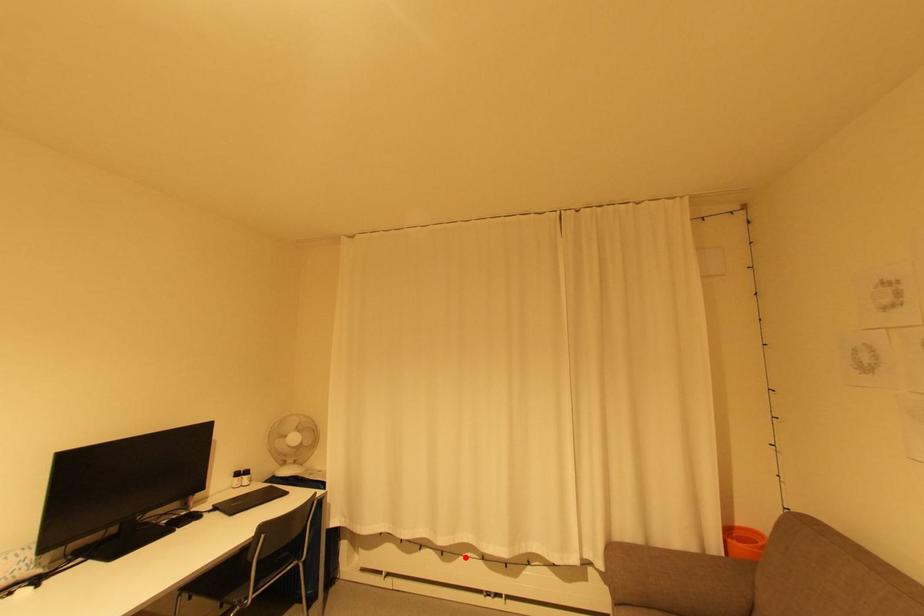
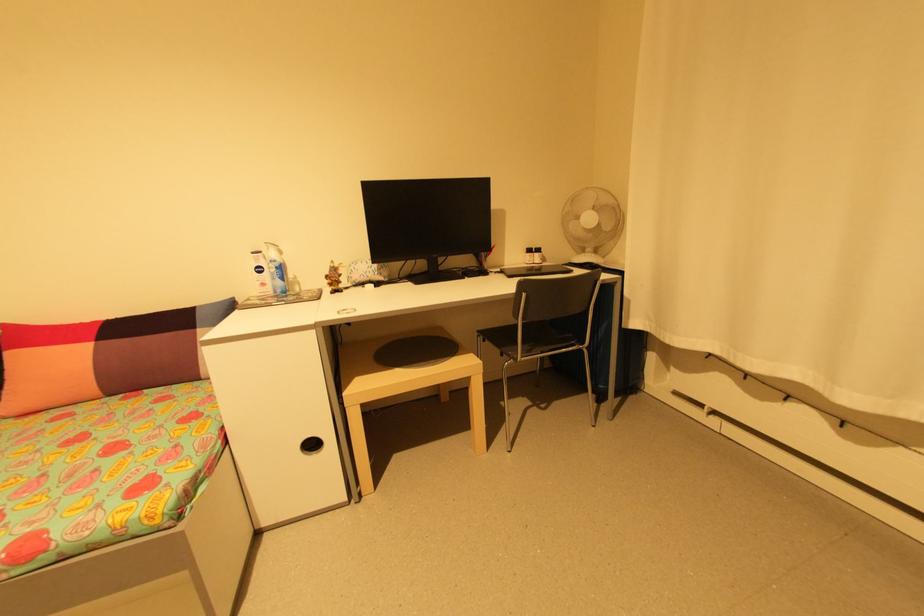
Question: I am providing you with two images of the same scene from different viewpoints. A red point is marked on the first image. Can you still see the location of the red point in image 2?

Choices:
 (A) Yes
 (B) No

Answer: (A)